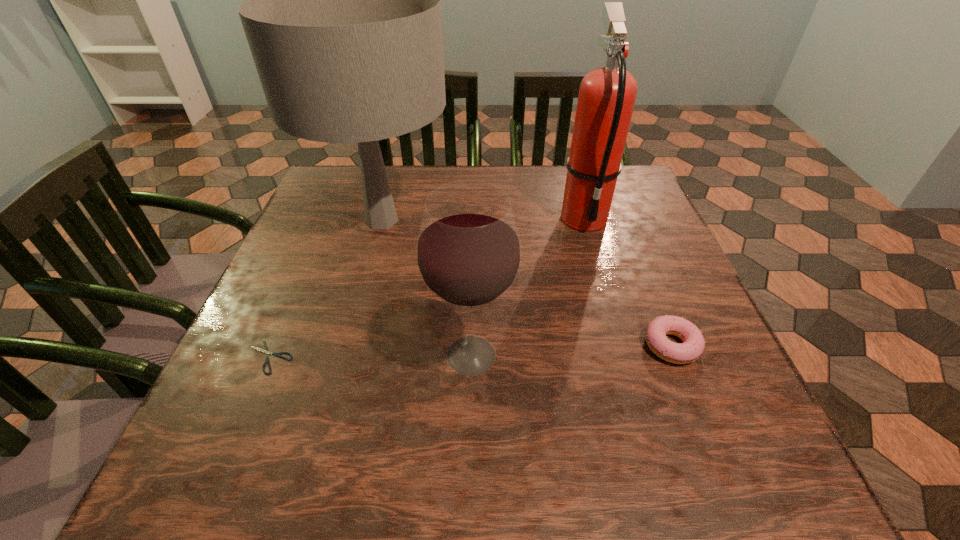
Locate an element on the screen. The image size is (960, 540). lampshade is located at coordinates (342, 13).

Locate an element on the screen. fire extinguisher is located at coordinates (607, 94).

Find the location of a particular element. The height and width of the screenshot is (540, 960). alcohol is located at coordinates (468, 254).

You are a GUI agent. You are given a task and a screenshot of the screen. Output one action in this format:
    pyautogui.click(x=<x>, y=<y>)
    Task: Click on the doughnut
    The height and width of the screenshot is (540, 960).
    Given the screenshot: What is the action you would take?
    pyautogui.click(x=693, y=345)

I want to click on shears, so click(x=265, y=351).

Where is `free space located on the front-facing side of the lampshade`? The height and width of the screenshot is (540, 960). free space located on the front-facing side of the lampshade is located at coordinates (613, 221).

Find the location of a particular element. This screenshot has height=540, width=960. vacant space located 0.230m on the hose direction of the fire extinguisher is located at coordinates (613, 320).

Identify the location of free space located on the left of the third shortest object. (262, 355).

At what (x,y) coordinates should I click in order to perform the action: click on vacant point located 0.120m on the left of the second shortest object. Please return your answer as a coordinate pair (x, y). Image resolution: width=960 pixels, height=540 pixels. Looking at the image, I should click on (576, 345).

I want to click on vacant space located 0.360m on the back of the shears, so pos(327,222).